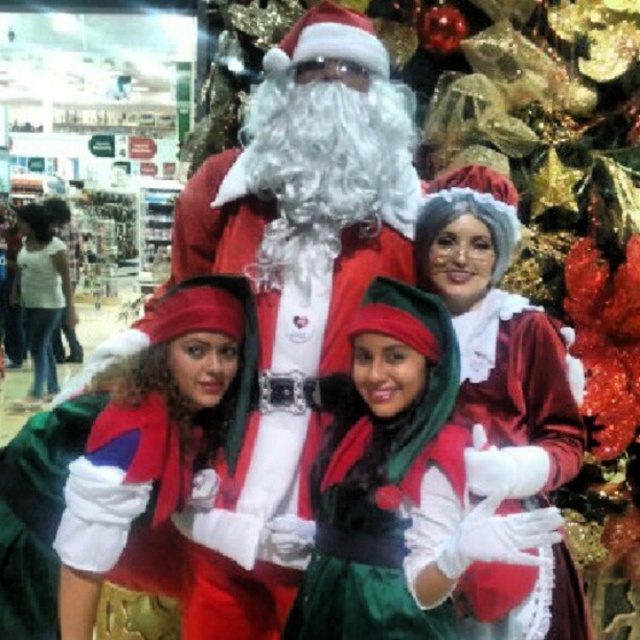
You are a photographer at the mall and want to take a picture of the velvet red santa at center. You need to position your camera at the point marked by the coordinates given. Is the point at coordinates point [289,298] the correct location to capture the velvet red santa at center in the frame?

Yes, the point at coordinates point [289,298] marks the location of the velvet red santa at center, so positioning the camera there would ensure the santa is in the frame.

You are standing at the point labeled as point [538,484] in the image. You want to move to the point labeled as point [230,600]. Which direction should you walk relative to your current position?

To reach point [230,600] from point [538,484], you should walk forward since point [230,600] is behind point [538,484].